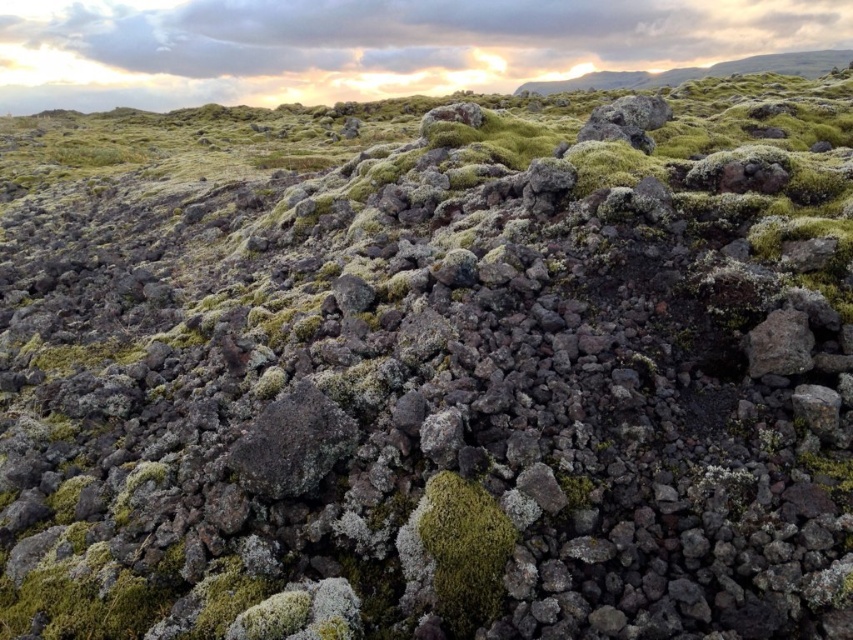
Question: Which of the following is the closest to the observer?

Choices:
 (A) (456, 504)
 (B) (302, 438)
 (C) (787, 328)

Answer: (A)

Question: Is dark gray rock at center to the right of gray rough rock at right from the viewer's perspective?

Choices:
 (A) no
 (B) yes

Answer: (A)

Question: Which point is closer to the camera?

Choices:
 (A) (805, 352)
 (B) (474, 506)
 (C) (271, 419)

Answer: (B)

Question: Can you confirm if dark gray rock at center is wider than gray rough rock at right?

Choices:
 (A) no
 (B) yes

Answer: (B)

Question: Which point is closer to the camera?

Choices:
 (A) green mossy rock at center
 (B) gray rough rock at right

Answer: (A)

Question: Does green mossy rock at center appear on the right side of dark gray rock at center?

Choices:
 (A) no
 (B) yes

Answer: (B)